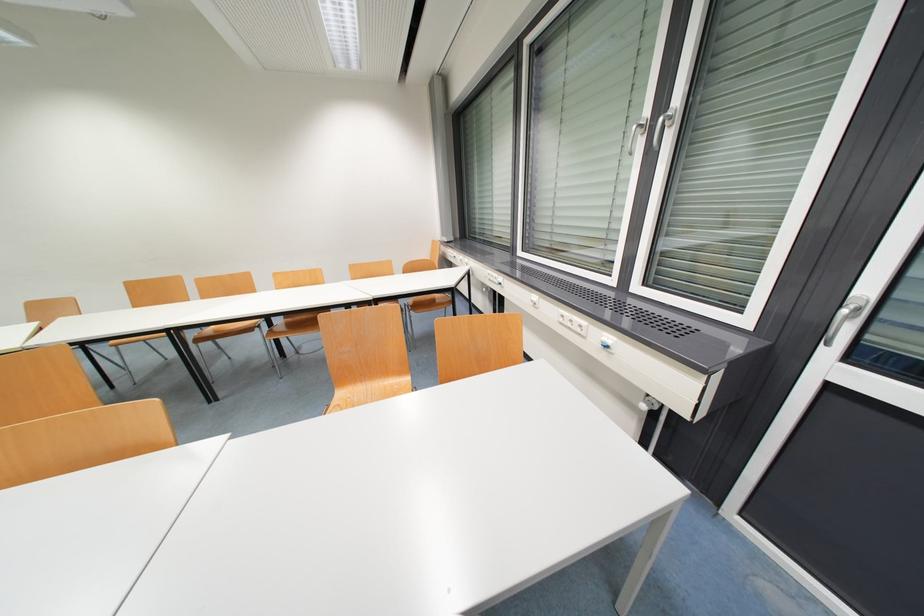
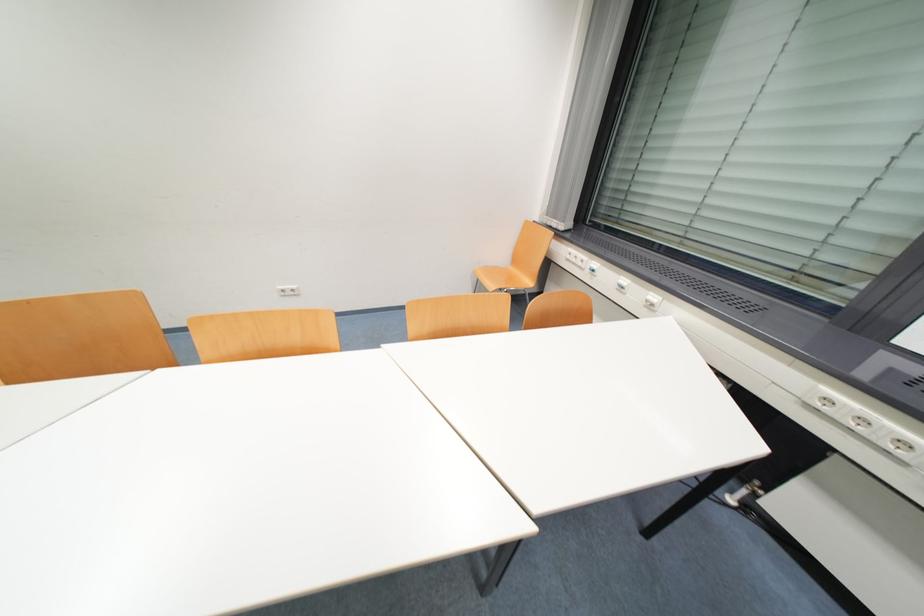
Which direction would the cameraman need to move to produce the second image?

The cameraman moved toward left, forward.